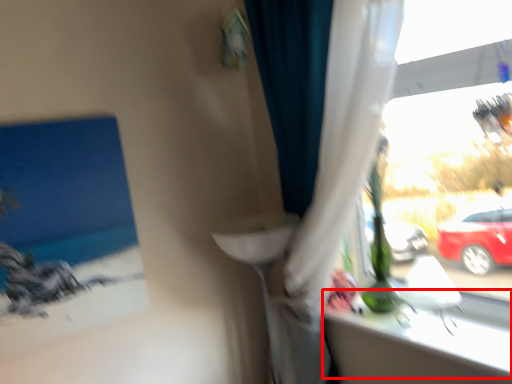
Question: Considering the relative positions of window sill (annotated by the red box) and curtain in the image provided, where is window sill (annotated by the red box) located with respect to the staircase?

Choices:
 (A) left
 (B) right

Answer: (B)